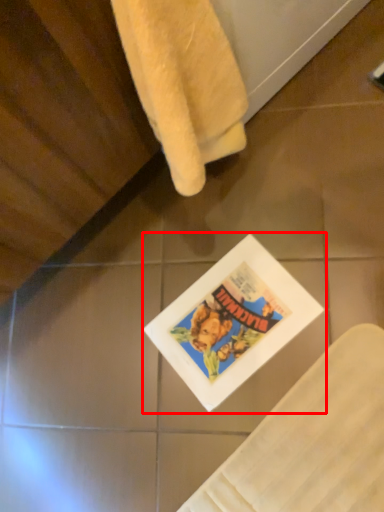
Question: From the image's perspective, what is the correct spatial positioning of comic book (annotated by the red box) in reference to towel?

Choices:
 (A) below
 (B) above

Answer: (A)